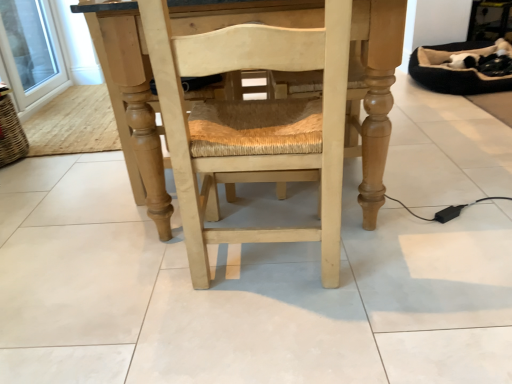
Question: Should I look upward or downward to see light wood chair at center?

Choices:
 (A) up
 (B) down

Answer: (A)

Question: Does transparent glass door at upper left have a larger size compared to light wood chair at center?

Choices:
 (A) yes
 (B) no

Answer: (B)

Question: Can you confirm if transparent glass door at upper left is smaller than light wood chair at center?

Choices:
 (A) yes
 (B) no

Answer: (A)

Question: Can you confirm if transparent glass door at upper left is taller than light wood chair at center?

Choices:
 (A) no
 (B) yes

Answer: (A)

Question: Can you confirm if transparent glass door at upper left is shorter than light wood chair at center?

Choices:
 (A) yes
 (B) no

Answer: (A)

Question: From the image's perspective, is transparent glass door at upper left located beneath light wood chair at center?

Choices:
 (A) yes
 (B) no

Answer: (B)

Question: Does transparent glass door at upper left turn towards light wood chair at center?

Choices:
 (A) no
 (B) yes

Answer: (A)

Question: Considering the relative positions of light wood chair at center and transparent glass door at upper left in the image provided, is light wood chair at center to the left of transparent glass door at upper left from the viewer's perspective?

Choices:
 (A) yes
 (B) no

Answer: (B)

Question: Is light wood chair at center completely or partially outside of transparent glass door at upper left?

Choices:
 (A) yes
 (B) no

Answer: (A)

Question: Considering the relative sizes of light wood chair at center and transparent glass door at upper left in the image provided, is light wood chair at center thinner than transparent glass door at upper left?

Choices:
 (A) yes
 (B) no

Answer: (B)

Question: Considering the relative sizes of light wood chair at center and transparent glass door at upper left in the image provided, is light wood chair at center taller than transparent glass door at upper left?

Choices:
 (A) yes
 (B) no

Answer: (A)

Question: Considering the relative sizes of light wood chair at center and transparent glass door at upper left in the image provided, is light wood chair at center smaller than transparent glass door at upper left?

Choices:
 (A) yes
 (B) no

Answer: (B)

Question: Is light wood chair at center positioned in front of transparent glass door at upper left?

Choices:
 (A) no
 (B) yes

Answer: (B)

Question: Based on their positions, is transparent glass door at upper left located to the left or right of light wood chair at center?

Choices:
 (A) right
 (B) left

Answer: (B)